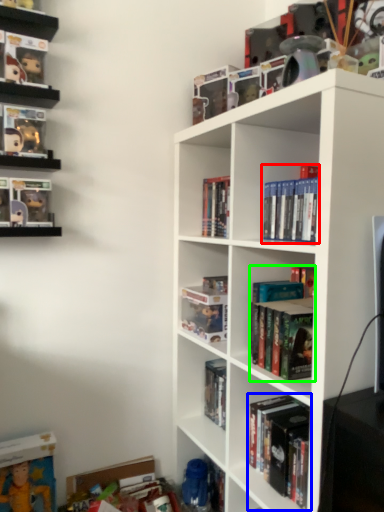
Question: Estimate the real-world distances between objects in this image. Which object is closer to book (highlighted by a red box), book (highlighted by a blue box) or book (highlighted by a green box)?

Choices:
 (A) book
 (B) book

Answer: (B)